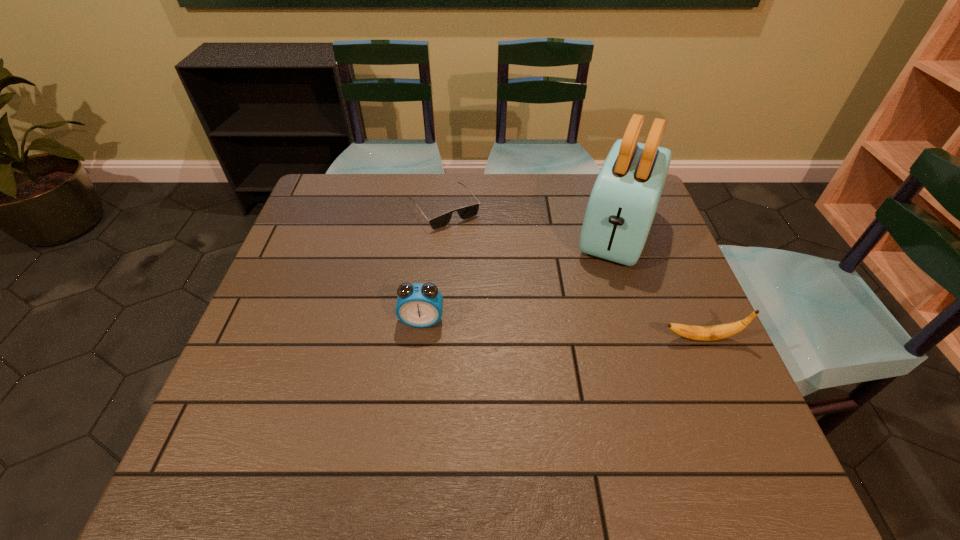
Find the location of a particular element. The width and height of the screenshot is (960, 540). the third farthest object is located at coordinates (419, 305).

What are the coordinates of `alarm clock` in the screenshot? It's located at (419, 305).

The width and height of the screenshot is (960, 540). I want to click on the third tallest object, so click(702, 333).

Identify the location of banana. Image resolution: width=960 pixels, height=540 pixels. (702, 333).

The width and height of the screenshot is (960, 540). In order to click on sunglasses in this screenshot , I will do `click(467, 212)`.

Locate an element on the screen. Image resolution: width=960 pixels, height=540 pixels. toaster is located at coordinates (624, 199).

Find the location of a particular element. The height and width of the screenshot is (540, 960). blank space located 0.100m on the face of the third farthest object is located at coordinates click(x=417, y=366).

At what (x,y) coordinates should I click in order to perform the action: click on vacant space located on the peel of the banana from the top. Please return your answer as a coordinate pair (x, y). The image size is (960, 540). Looking at the image, I should click on (495, 338).

This screenshot has height=540, width=960. What are the coordinates of `free region located on the peel of the banana from the top` in the screenshot? It's located at (601, 338).

Find the location of `vacant area located 0.220m on the peel of the banana from the top`. vacant area located 0.220m on the peel of the banana from the top is located at coordinates (565, 338).